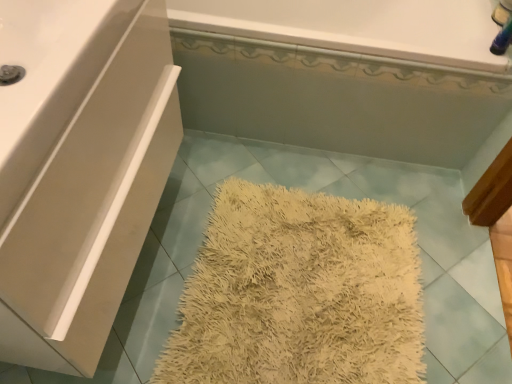
Question: Can we say white glossy counter top at upper left lies outside white matte cabinet at upper left?

Choices:
 (A) yes
 (B) no

Answer: (B)

Question: Is white glossy counter top at upper left positioned behind white matte cabinet at upper left?

Choices:
 (A) yes
 (B) no

Answer: (B)

Question: Considering the relative sizes of white glossy counter top at upper left and white matte cabinet at upper left in the image provided, is white glossy counter top at upper left thinner than white matte cabinet at upper left?

Choices:
 (A) yes
 (B) no

Answer: (A)

Question: Is white glossy counter top at upper left far away from white matte cabinet at upper left?

Choices:
 (A) yes
 (B) no

Answer: (B)

Question: Is the depth of white glossy counter top at upper left less than that of white matte cabinet at upper left?

Choices:
 (A) no
 (B) yes

Answer: (B)

Question: From the image's perspective, is white glossy counter top at upper left located above white matte cabinet at upper left?

Choices:
 (A) yes
 (B) no

Answer: (A)

Question: Can you confirm if white glossy bathtub at upper center, the 2th bath positioned from the front, is thinner than white glossy bathtub at upper center, the 1th bath in the front-to-back sequence?

Choices:
 (A) no
 (B) yes

Answer: (B)

Question: Considering the relative sizes of white glossy bathtub at upper center, marked as the 1th bath in a back-to-front arrangement, and white glossy bathtub at upper center, the 1th bath in the front-to-back sequence, in the image provided, is white glossy bathtub at upper center, marked as the 1th bath in a back-to-front arrangement, taller than white glossy bathtub at upper center, the 1th bath in the front-to-back sequence,?

Choices:
 (A) no
 (B) yes

Answer: (A)

Question: Is the position of white glossy bathtub at upper center, the 2th bath positioned from the front, more distant than that of white glossy bathtub at upper center, the 1th bath in the front-to-back sequence?

Choices:
 (A) no
 (B) yes

Answer: (B)

Question: Can we say white glossy bathtub at upper center, the 2th bath positioned from the front, lies outside white glossy bathtub at upper center, which is counted as the second bath, starting from the back?

Choices:
 (A) yes
 (B) no

Answer: (A)

Question: Is white glossy bathtub at upper center, the 2th bath positioned from the front, far from white glossy bathtub at upper center, which is counted as the second bath, starting from the back?

Choices:
 (A) no
 (B) yes

Answer: (A)

Question: From the image's perspective, is white glossy bathtub at upper center, the 2th bath positioned from the front, below white glossy bathtub at upper center, the 1th bath in the front-to-back sequence?

Choices:
 (A) yes
 (B) no

Answer: (A)

Question: Does white glossy bathtub at upper center, the 1th bath in the front-to-back sequence, lie in front of white matte cabinet at upper left?

Choices:
 (A) no
 (B) yes

Answer: (A)